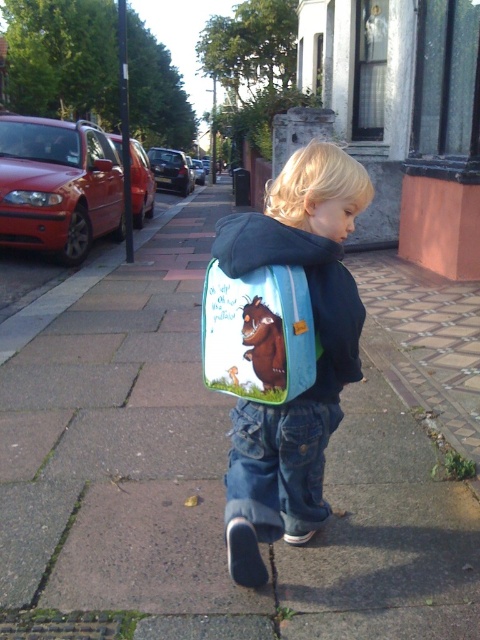
The child is walking on the brown stone pavement at center while carrying the blue fabric backpack at center. How far apart are these two objects?

The brown stone pavement at center is 27.06 inches from blue fabric backpack at center.